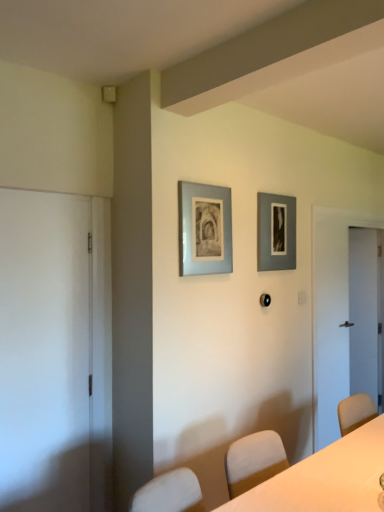
Question: Based on their positions, is matte gray picture frame at upper center, the first picture frame when ordered from back to front, located to the left or right of white glossy table at center?

Choices:
 (A) left
 (B) right

Answer: (B)

Question: In terms of size, does matte gray picture frame at upper center, which appears as the 2th picture frame when viewed from the front, appear bigger or smaller than white glossy table at center?

Choices:
 (A) big
 (B) small

Answer: (B)

Question: Considering the real-world distances, which object is farthest from the white matte door at left, which is the second door from right to left?

Choices:
 (A) light blue matte picture frame at upper center, which is the second picture frame from right to left
 (B) white glossy table at center
 (C) white glossy door at right, the second door positioned from the front
 (D) matte gray picture frame at upper center, the 2th picture frame viewed from the left

Answer: (C)

Question: Estimate the real-world distances between objects in this image. Which object is closer to the white glossy door at right, the second door positioned from the front?

Choices:
 (A) white glossy table at center
 (B) white matte door at left, marked as the first door in a left-to-right arrangement
 (C) matte gray picture frame at upper center, the first picture frame when ordered from back to front
 (D) light blue matte picture frame at upper center, placed as the first picture frame when sorted from left to right

Answer: (C)